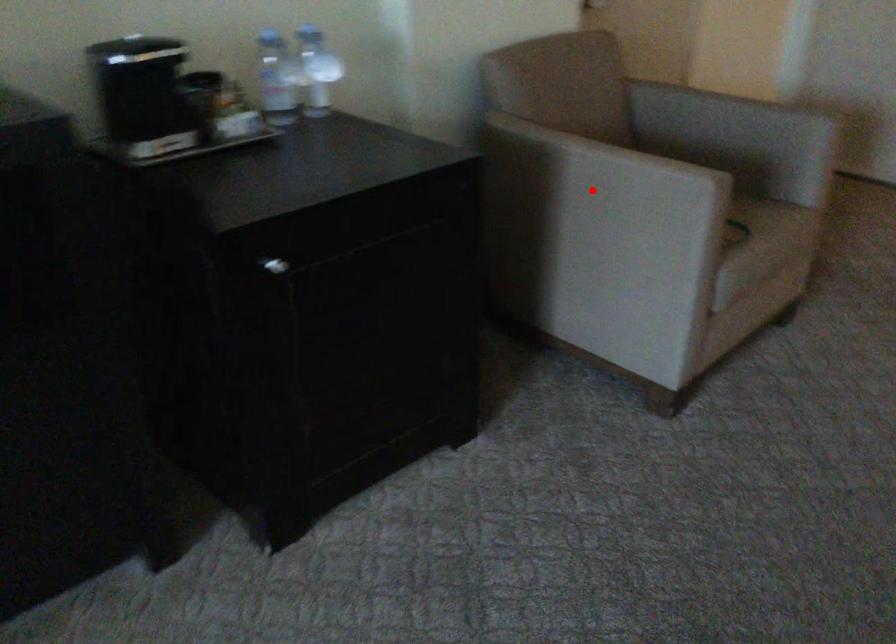
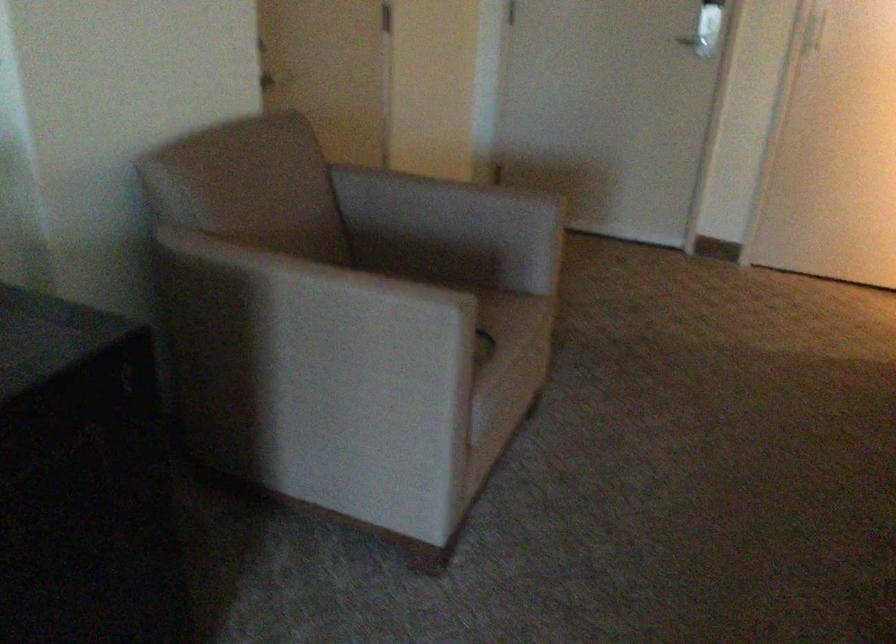
Locate, in the second image, the point that corresponds to the highlighted location in the first image.

(314, 325)